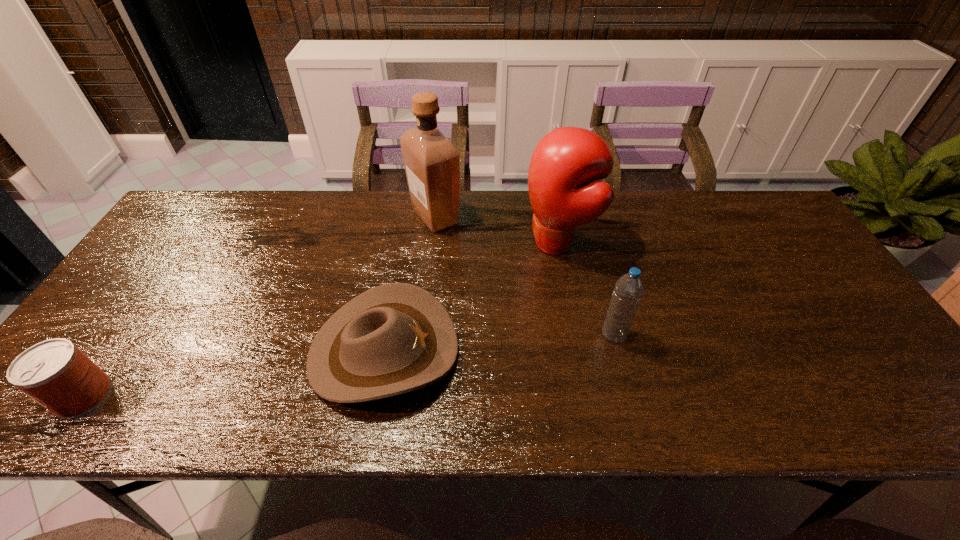
This screenshot has height=540, width=960. What are the coordinates of `vacant space in between the liquor and the can` in the screenshot? It's located at (259, 306).

Locate an element on the screen. vacant space that's between the cowboy hat and the water bottle is located at coordinates (498, 343).

This screenshot has height=540, width=960. I want to click on blank region between the liquor and the boxing glove, so click(x=496, y=230).

Where is `blank region between the liquor and the cowboy hat`? This screenshot has height=540, width=960. blank region between the liquor and the cowboy hat is located at coordinates (x=410, y=284).

Locate which object is the third closest to the boxing glove. Please provide its 2D coordinates. Your answer should be formatted as a tuple, i.e. [(x, y)], where the tuple contains the x and y coordinates of a point satisfying the conditions above.

[(395, 338)]

Choose which object is the fourth nearest neighbor to the third shortest object. Please provide its 2D coordinates. Your answer should be formatted as a tuple, i.e. [(x, y)], where the tuple contains the x and y coordinates of a point satisfying the conditions above.

[(55, 373)]

You are a GUI agent. You are given a task and a screenshot of the screen. Output one action in this format:
    pyautogui.click(x=<x>, y=<y>)
    Task: Click on the free location that satisfies the following two spatial constraints: 1. on the striking surface of the boxing glove; 2. on the left side of the water bottle
    This screenshot has width=960, height=540.
    Given the screenshot: What is the action you would take?
    pyautogui.click(x=575, y=335)

Where is `vacant position in the image that satisfies the following two spatial constraints: 1. with a star on the front of the cowboy hat; 2. on the front side of the leftmost object`? The height and width of the screenshot is (540, 960). vacant position in the image that satisfies the following two spatial constraints: 1. with a star on the front of the cowboy hat; 2. on the front side of the leftmost object is located at coordinates (375, 395).

Find the location of a particular element. This screenshot has height=540, width=960. free space that satisfies the following two spatial constraints: 1. on the front-facing side of the liquor; 2. on the back side of the water bottle is located at coordinates (421, 335).

I want to click on vacant space that satisfies the following two spatial constraints: 1. on the front-facing side of the liquor; 2. on the left side of the water bottle, so click(x=421, y=335).